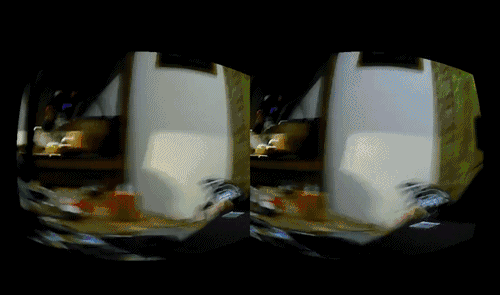
Identify the location of messy room. This screenshot has height=295, width=500. [141, 162], [395, 198].